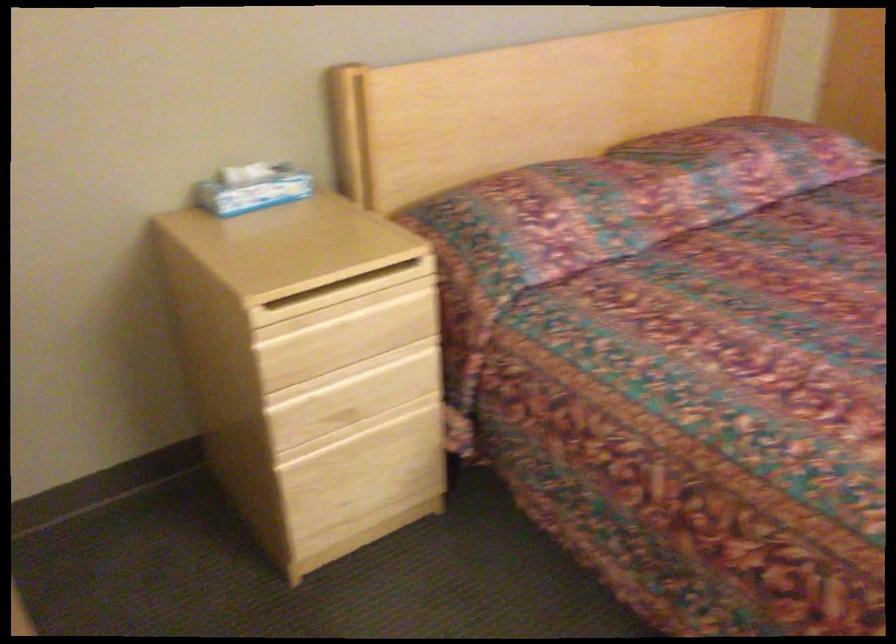
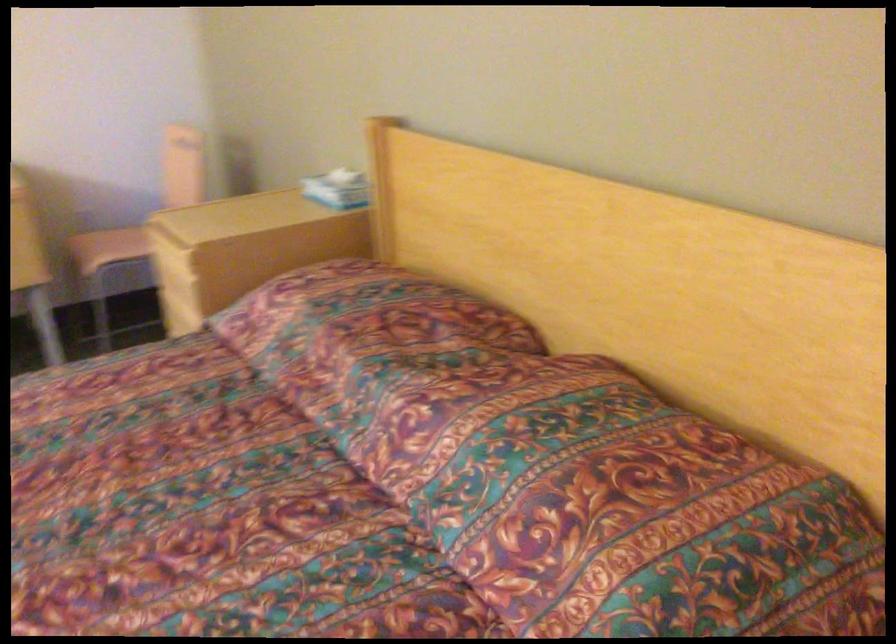
In the second image, find the point that corresponds to point 289,182 in the first image.

(338, 190)